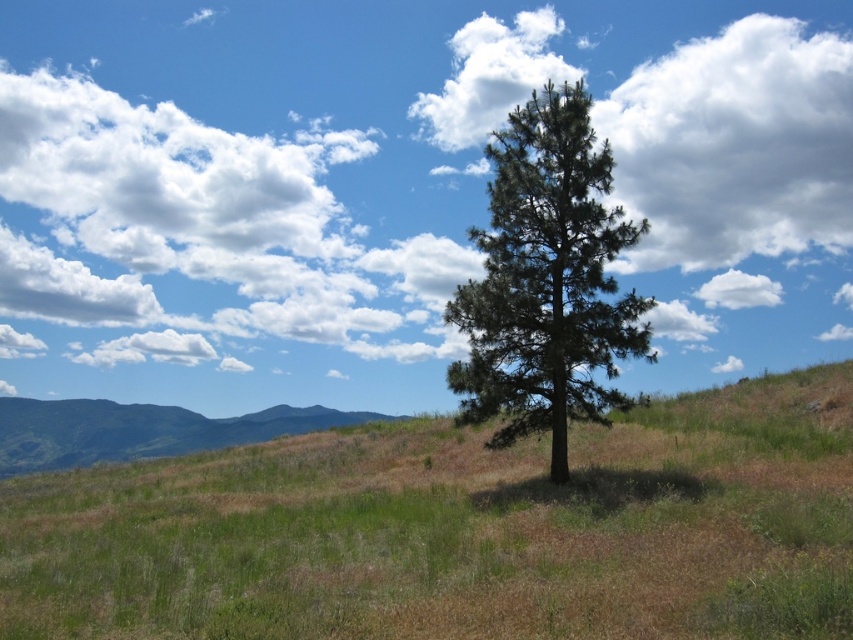
Which is more to the left, green needle-like tree at center or white fluffy cloud at upper center?

white fluffy cloud at upper center is more to the left.

Is green needle-like tree at center wider than white fluffy cloud at upper center?

No, green needle-like tree at center is not wider than white fluffy cloud at upper center.

Measure the distance between green needle-like tree at center and camera.

The distance of green needle-like tree at center from camera is 51.06 feet.

Find the location of a particular element. green needle-like tree at center is located at coordinates (546, 282).

Is white fluffy cloud at upper right taller than green needle-like tree at center?

No, white fluffy cloud at upper right is not taller than green needle-like tree at center.

Looking at this image, can you confirm if white fluffy cloud at upper right is positioned to the left of green needle-like tree at center?

Incorrect, white fluffy cloud at upper right is not on the left side of green needle-like tree at center.

Find the location of a particular element. white fluffy cloud at upper right is located at coordinates (735, 145).

Find the location of a particular element. The width and height of the screenshot is (853, 640). white fluffy cloud at upper right is located at coordinates (735, 145).

Between point (137, 451) and point (558, 68), which one is positioned behind?

Point (558, 68)

Is point (160, 445) positioned before point (503, 84)?

Yes.

Which is in front, point (195, 436) or point (491, 80)?

Positioned in front is point (195, 436).

Locate an element on the screen. Image resolution: width=853 pixels, height=640 pixels. green grassy hillside at lower left is located at coordinates (138, 429).